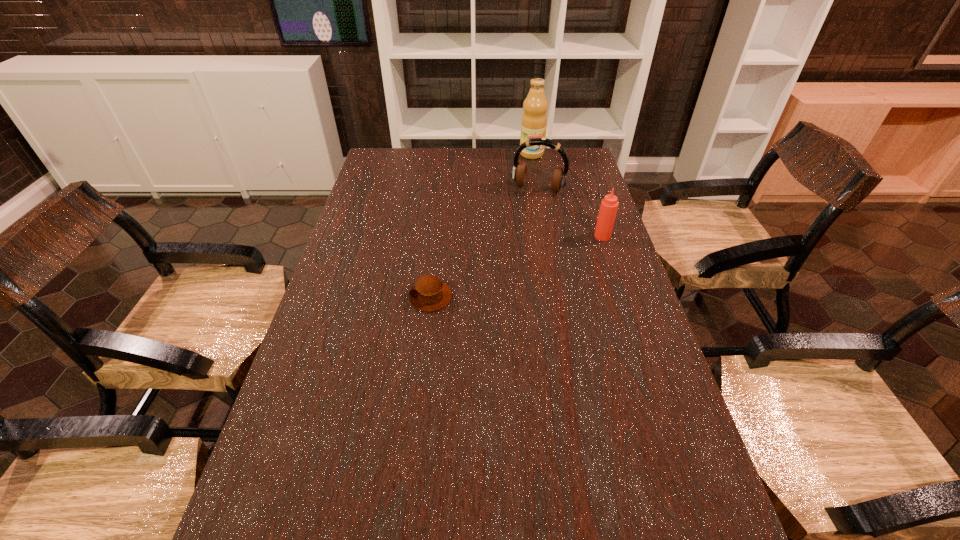
Identify the location of empty location between the leftmost object and the farthest object. (481, 226).

I want to click on vacant space in between the farthest object and the third farthest object, so click(x=567, y=195).

Point out which object is positioned as the second nearest to the third farthest object. Please provide its 2D coordinates. Your answer should be formatted as a tuple, i.e. [(x, y)], where the tuple contains the x and y coordinates of a point satisfying the conditions above.

[(430, 293)]

The width and height of the screenshot is (960, 540). Find the location of `the closest object relative to the third farthest object`. the closest object relative to the third farthest object is located at coordinates (519, 171).

I want to click on free space that satisfies the following two spatial constraints: 1. on the back side of the headset; 2. on the left side of the nearest object, so click(x=443, y=188).

At what (x,y) coordinates should I click in order to perform the action: click on vacant area in the image that satisfies the following two spatial constraints: 1. on the back side of the shortest object; 2. on the left side of the farthest object. Please return your answer as a coordinate pair (x, y). The height and width of the screenshot is (540, 960). Looking at the image, I should click on (446, 154).

Where is `free space that satisfies the following two spatial constraints: 1. on the front side of the headset; 2. on the right side of the rightmost object`? This screenshot has width=960, height=540. free space that satisfies the following two spatial constraints: 1. on the front side of the headset; 2. on the right side of the rightmost object is located at coordinates (546, 236).

This screenshot has height=540, width=960. I want to click on free location that satisfies the following two spatial constraints: 1. on the front side of the headset; 2. on the left side of the third farthest object, so click(546, 236).

The width and height of the screenshot is (960, 540). I want to click on free spot that satisfies the following two spatial constraints: 1. on the back side of the third nearest object; 2. on the left side of the shortest object, so click(443, 188).